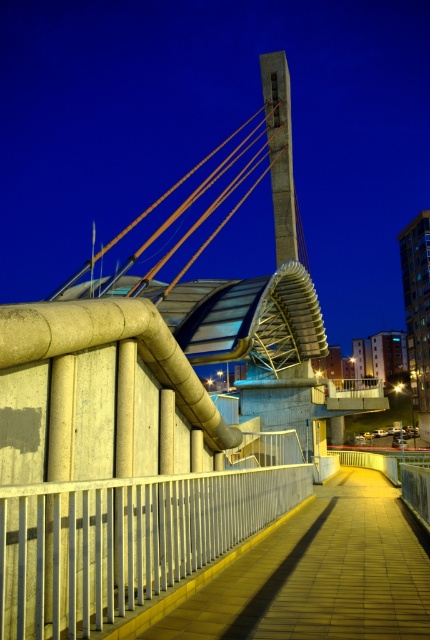
You are standing on the yellow concrete path at center and want to hold onto the silver metallic railing at center for balance. In which direction should you move to reach it?

The silver metallic railing at center is positioned on the left side of the yellow concrete path at center, so you should move to your left to reach it.

You are standing on the yellow concrete path at center and want to hold onto a railing for support. Is the silver metallic railing at center accessible from your current position?

The silver metallic railing at center is above the yellow concrete path at center, so yes, the railing is accessible from the path as it is positioned above it.